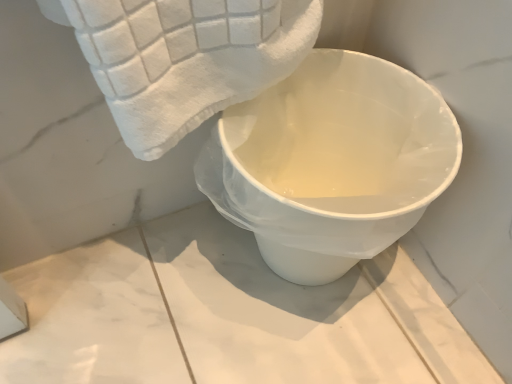
Question: Does white soft towel at upper left lie behind white glossy toilet at center?

Choices:
 (A) no
 (B) yes

Answer: (A)

Question: Can you confirm if white soft towel at upper left is bigger than white glossy toilet at center?

Choices:
 (A) no
 (B) yes

Answer: (A)

Question: From the image's perspective, is white soft towel at upper left located above white glossy toilet at center?

Choices:
 (A) yes
 (B) no

Answer: (A)

Question: Considering the relative sizes of white soft towel at upper left and white glossy toilet at center in the image provided, is white soft towel at upper left thinner than white glossy toilet at center?

Choices:
 (A) yes
 (B) no

Answer: (A)

Question: Considering the relative sizes of white soft towel at upper left and white glossy toilet at center in the image provided, is white soft towel at upper left smaller than white glossy toilet at center?

Choices:
 (A) no
 (B) yes

Answer: (B)

Question: Can you confirm if white soft towel at upper left is shorter than white glossy toilet at center?

Choices:
 (A) no
 (B) yes

Answer: (B)

Question: Is white glossy toilet at center to the left of white soft towel at upper left from the viewer's perspective?

Choices:
 (A) yes
 (B) no

Answer: (B)

Question: Is white glossy toilet at center positioned with its back to white soft towel at upper left?

Choices:
 (A) no
 (B) yes

Answer: (A)

Question: Does white glossy toilet at center have a greater width compared to white soft towel at upper left?

Choices:
 (A) yes
 (B) no

Answer: (A)

Question: From the image's perspective, is white glossy toilet at center beneath white soft towel at upper left?

Choices:
 (A) no
 (B) yes

Answer: (B)

Question: Is the position of white glossy toilet at center less distant than that of white soft towel at upper left?

Choices:
 (A) yes
 (B) no

Answer: (B)

Question: Considering the relative sizes of white glossy toilet at center and white soft towel at upper left in the image provided, is white glossy toilet at center smaller than white soft towel at upper left?

Choices:
 (A) no
 (B) yes

Answer: (A)

Question: In terms of width, does white glossy toilet at center look wider or thinner when compared to white soft towel at upper left?

Choices:
 (A) thin
 (B) wide

Answer: (B)